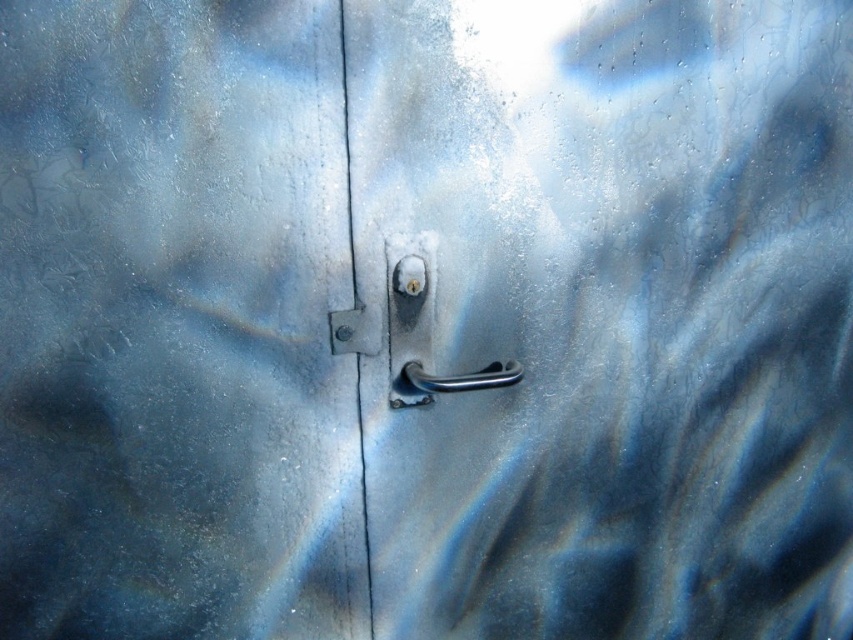
Is polished metal handle at center to the right of satin silver lock at center from the viewer's perspective?

Indeed, polished metal handle at center is positioned on the right side of satin silver lock at center.

Is polished metal handle at center bigger than satin silver lock at center?

Indeed, polished metal handle at center has a larger size compared to satin silver lock at center.

Measure the distance between polished metal handle at center and camera.

The distance of polished metal handle at center from camera is 3.82 feet.

This screenshot has height=640, width=853. I want to click on polished metal handle at center, so click(450, 381).

Can you confirm if metallic silver handle at center is bigger than satin silver handle at center?

Correct, metallic silver handle at center is larger in size than satin silver handle at center.

Which is behind, point (381, 212) or point (409, 285)?

Point (409, 285)

Does point (397, 566) lie behind point (517, 365)?

Yes, point (397, 566) is farther from viewer.

At what (x,y) coordinates should I click in order to perform the action: click on metallic silver handle at center. Please return your answer as a coordinate pair (x, y). This screenshot has width=853, height=640. Looking at the image, I should click on (606, 314).

Is metallic silver handle at center to the left of satin silver lock at center from the viewer's perspective?

Incorrect, metallic silver handle at center is not on the left side of satin silver lock at center.

Which of these two, metallic silver handle at center or satin silver lock at center, stands shorter?

satin silver lock at center is shorter.

The image size is (853, 640). Identify the location of metallic silver handle at center. (606, 314).